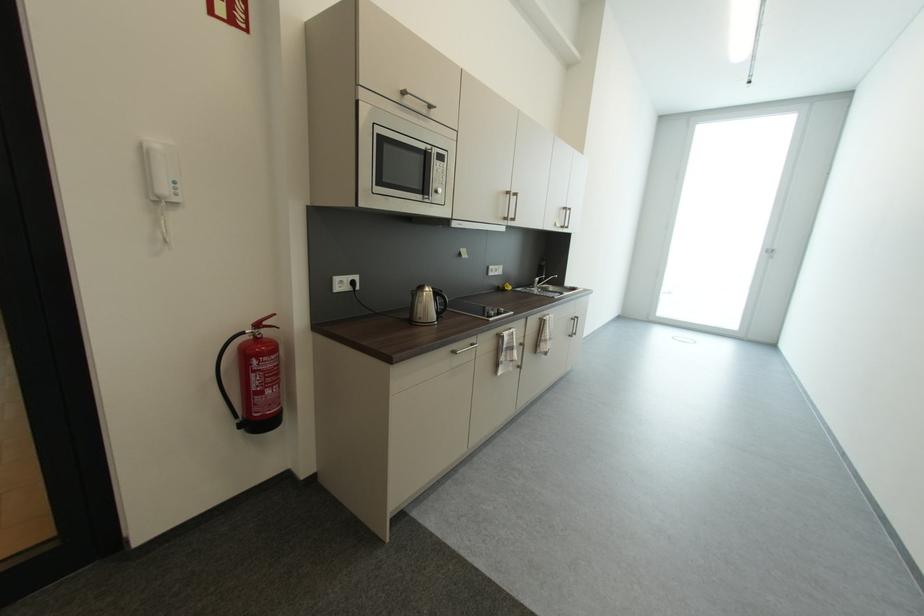
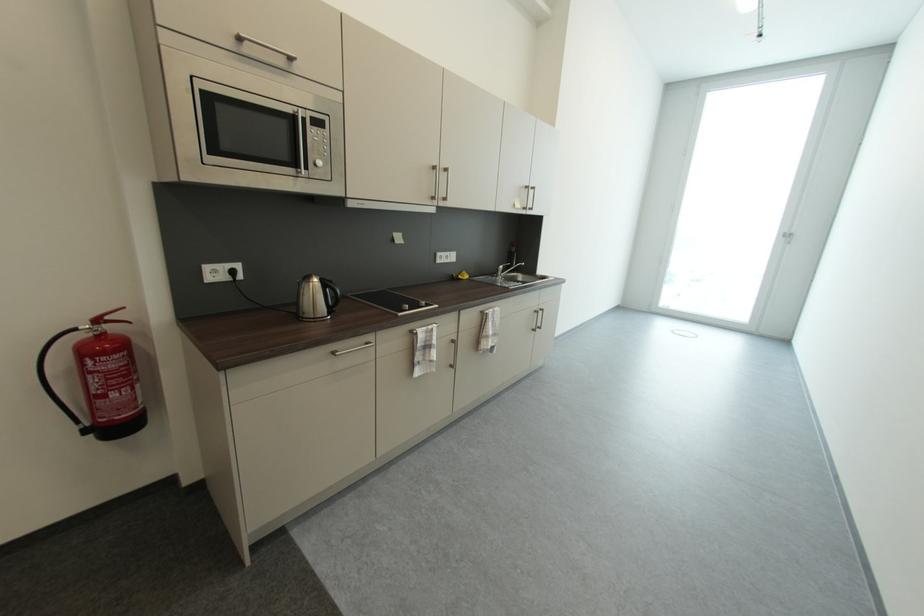
The point at (444, 193) is marked in the first image. Where is the corresponding point in the second image?

(322, 166)